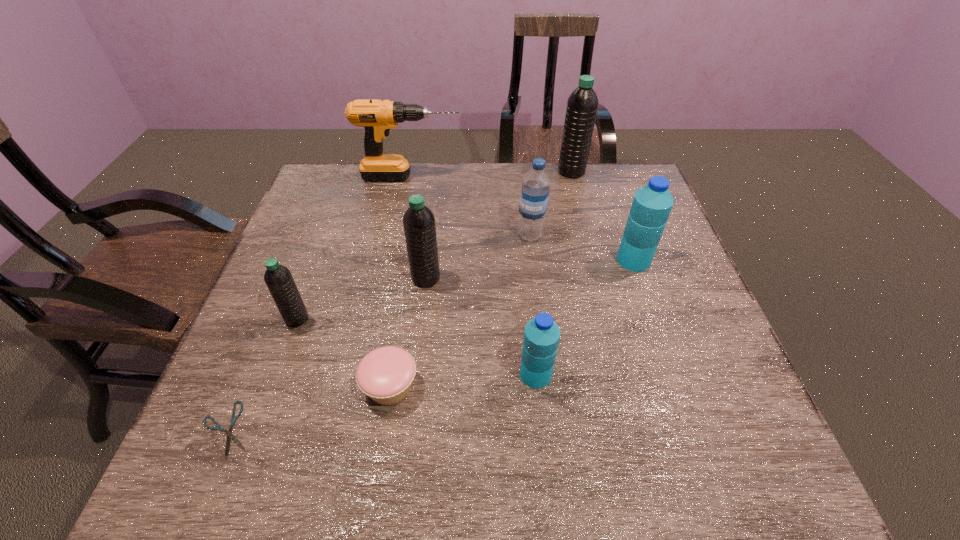
This screenshot has width=960, height=540. Find the location of `the leftmost black water bottle`. the leftmost black water bottle is located at coordinates (278, 278).

Find the location of a particular element. This screenshot has height=540, width=960. the nearest blue water bottle is located at coordinates (541, 336).

At what (x,y) coordinates should I click in order to perform the action: click on the nearest water bottle. Please return your answer as a coordinate pair (x, y). Image resolution: width=960 pixels, height=540 pixels. Looking at the image, I should click on (541, 336).

Locate an element on the screen. The image size is (960, 540). cupcake is located at coordinates (385, 374).

Locate an element on the screen. The width and height of the screenshot is (960, 540). the eighth tallest object is located at coordinates (385, 374).

You are a GUI agent. You are given a task and a screenshot of the screen. Output one action in this format:
    pyautogui.click(x=<x>, y=<y>)
    Task: Click on the black shears
    
    Given the screenshot: What is the action you would take?
    pyautogui.click(x=230, y=436)

Where is `shears`? shears is located at coordinates (230, 436).

You are a GUI agent. You are given a task and a screenshot of the screen. Output one action in this format:
    pyautogui.click(x=<x>, y=<y>)
    Task: Click on the vacant region located 0.120m on the front of the biggest black water bottle
    The width and height of the screenshot is (960, 540).
    Given the screenshot: What is the action you would take?
    pyautogui.click(x=579, y=202)

Where is `free space located 0.350m at the tip of the drill`? free space located 0.350m at the tip of the drill is located at coordinates (572, 177).

Locate an element on the screen. Image resolution: width=960 pixels, height=540 pixels. vacant point located 0.140m on the back of the second black water bottle from right to left is located at coordinates tap(431, 233).